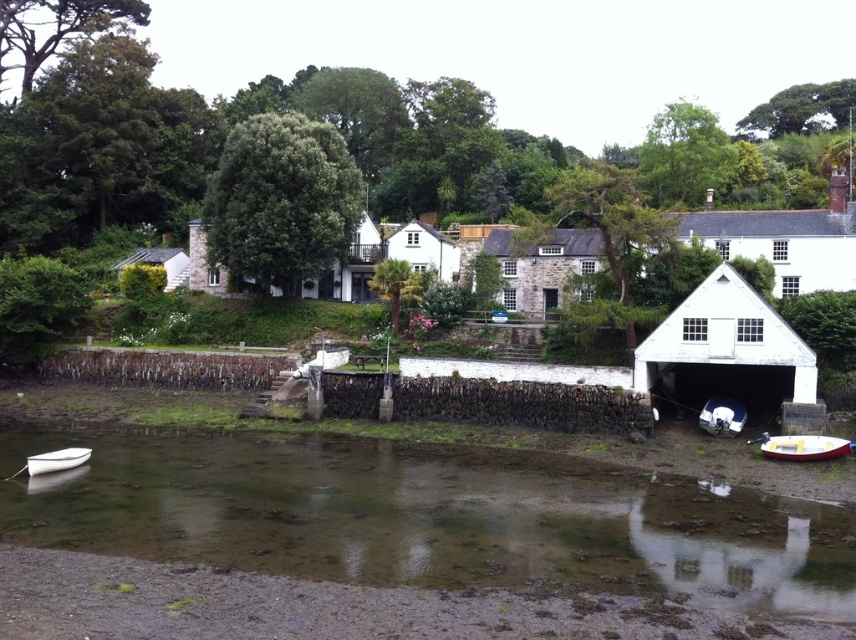
Who is higher up, clear water at lower center or white plastic boat at lower right?

white plastic boat at lower right is higher up.

Between clear water at lower center and white plastic boat at lower right, which one has less height?

With less height is white plastic boat at lower right.

Between point (519, 496) and point (813, 458), which one is positioned in front?

Point (519, 496) is in front.

Where is `clear water at lower center`? clear water at lower center is located at coordinates pyautogui.click(x=429, y=516).

Does white glossy boat at lower right lie in front of white matte boat at lower left?

No.

Between white glossy boat at lower right and white matte boat at lower left, which one is positioned lower?

white matte boat at lower left is lower down.

Does point (734, 413) come behind point (34, 458)?

Yes.

The image size is (856, 640). Find the location of `white glossy boat at lower right`. white glossy boat at lower right is located at coordinates (722, 417).

The image size is (856, 640). Identify the location of white plastic boat at lower right. (803, 445).

Does white plastic boat at lower right have a larger size compared to white glossy boat at lower right?

Indeed, white plastic boat at lower right has a larger size compared to white glossy boat at lower right.

Between point (810, 435) and point (739, 404), which one is positioned behind?

Point (739, 404)

What are the coordinates of `white plastic boat at lower right` in the screenshot? It's located at (803, 445).